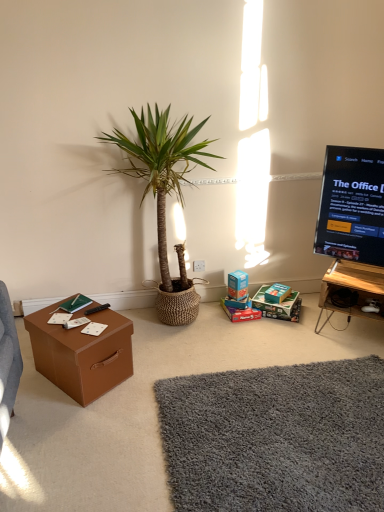
The width and height of the screenshot is (384, 512). What are the coordinates of `vacant space to the right of brown cardboard box at lower left` in the screenshot? It's located at (152, 372).